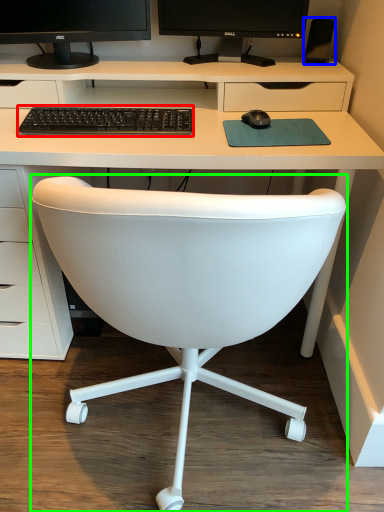
Question: Estimate the real-world distances between objects in this image. Which object is closer to computer keyboard (highlighted by a red box), speaker (highlighted by a blue box) or chair (highlighted by a green box)?

Choices:
 (A) speaker
 (B) chair

Answer: (B)